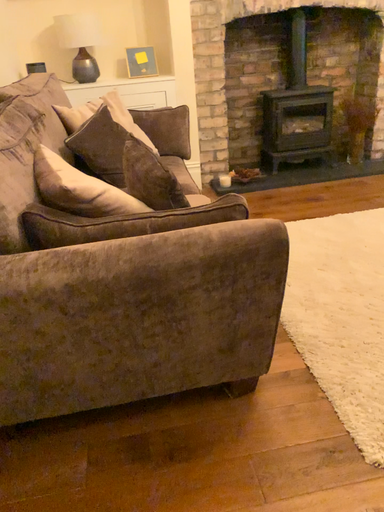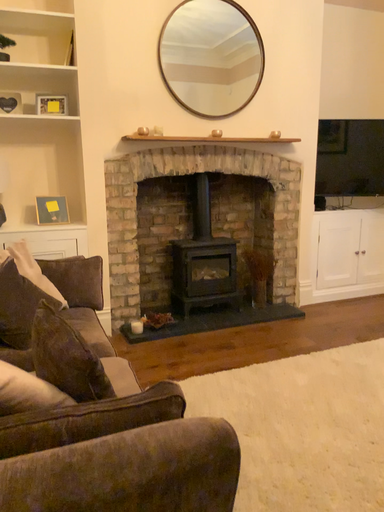
Question: How did the camera likely rotate when shooting the video?

Choices:
 (A) rotated downward
 (B) rotated upward

Answer: (B)